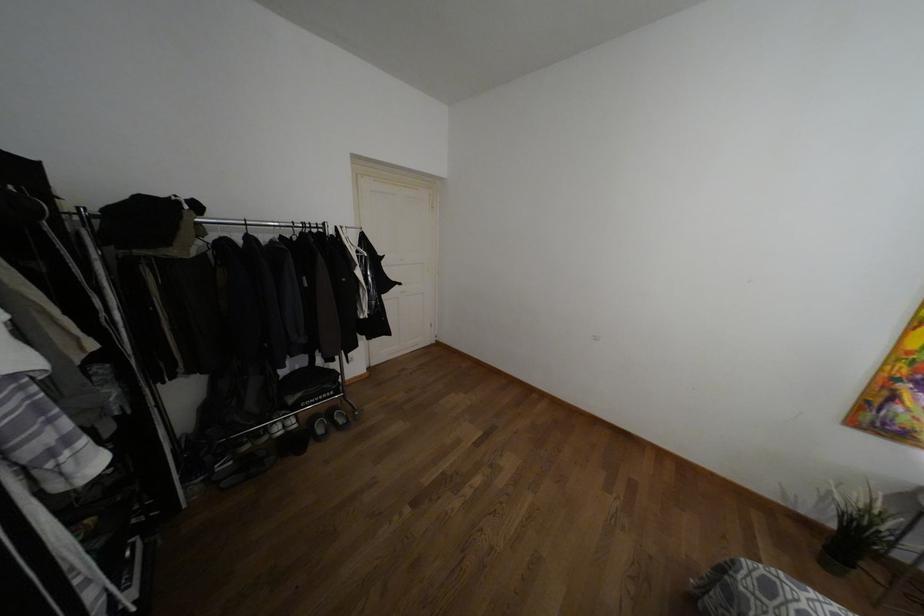
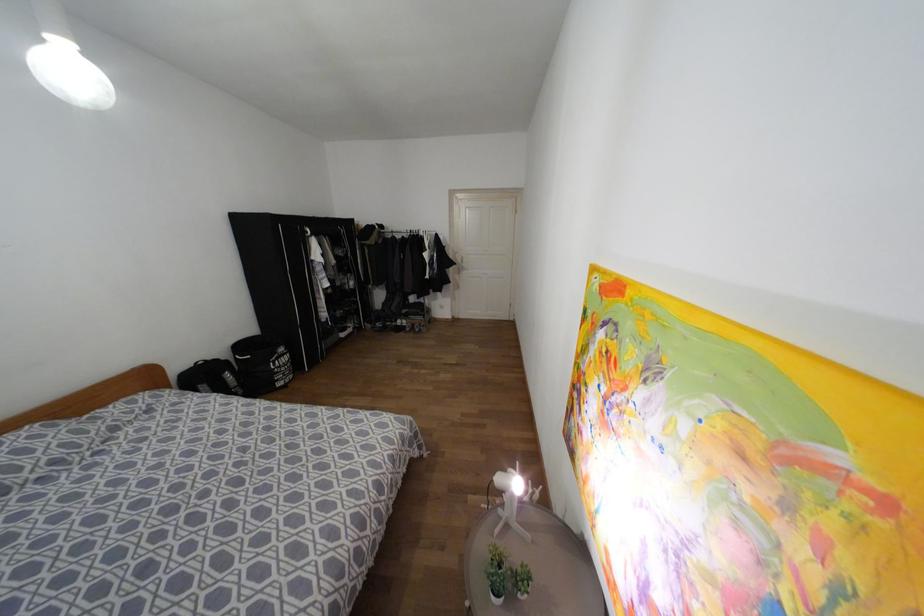
The point at (330, 231) is marked in the first image. Where is the corresponding point in the second image?

(419, 233)